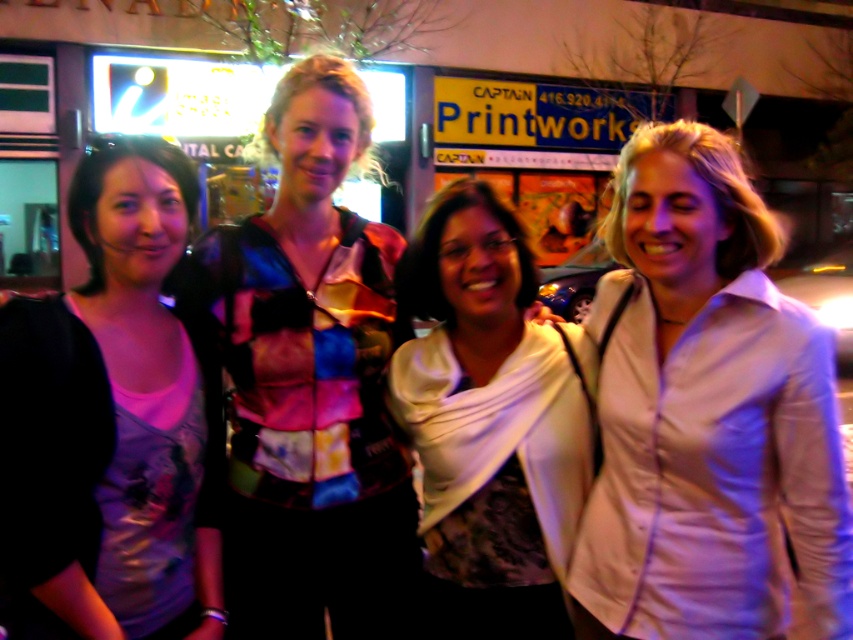
You are a photographer adjusting the camera focus. The matte black shirt at left and the white satin scarf at center are both in the frame. Given their distance apart, can you estimate whether they will both be in focus at the same time if the camera has a depth of field that can cover 25 inches?

The matte black shirt at left and white satin scarf at center are 24.75 inches apart. Since the camera depth of field can cover 25 inches, they will both be in focus at the same time.

You are standing at the point marked as point (151, 192) and want to take a photo of the group of women using a camera that has a minimum focusing distance of 1.5 meters. Can you take a clear photo of them from your current position?

The distance between point (151, 192) and the camera is 1.55 meters, which is just above the minimum focusing distance of 1.5 meters. Therefore, you can take a clear photo of the group of women from your current position.